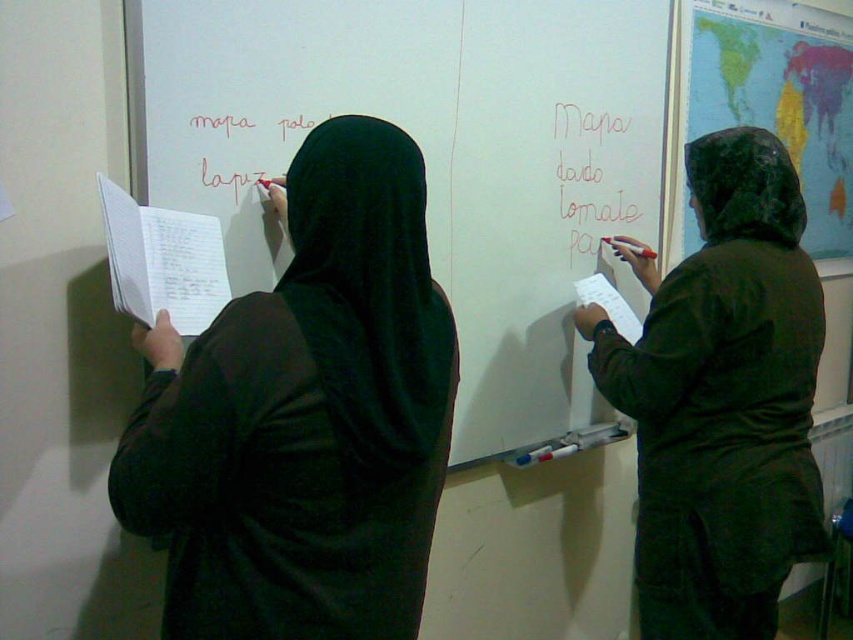
Does black matte hijab at upper left have a greater width compared to white paper at center?

→ Correct, the width of black matte hijab at upper left exceeds that of white paper at center.

Is black matte hijab at upper left below white paper at center?

Correct, black matte hijab at upper left is located below white paper at center.

Identify the location of black matte hijab at upper left. (305, 417).

Does point (294, 392) come behind point (809, 472)?

No, it is in front of (809, 472).

In the scene shown: Which is below, black matte hijab at upper left or dark green hooded jacket at right?

dark green hooded jacket at right

The height and width of the screenshot is (640, 853). I want to click on black matte hijab at upper left, so click(305, 417).

Between black matte hijab at upper left and white lined paper at left, which one has more height?

black matte hijab at upper left is taller.

Which is in front, point (347, 204) or point (131, 273)?

Point (347, 204)

Identify the location of black matte hijab at upper left. (305, 417).